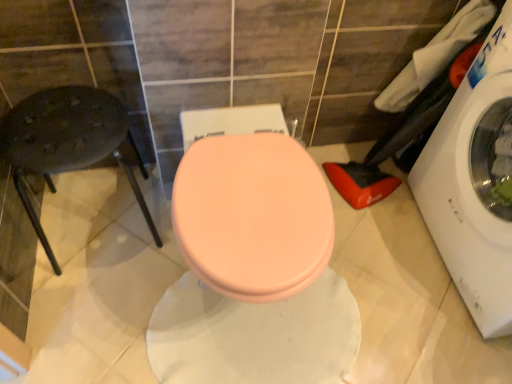
Describe the element at coordinates (67, 141) in the screenshot. The image size is (512, 384). I see `metallic black stool at left` at that location.

This screenshot has width=512, height=384. What do you see at coordinates (475, 183) in the screenshot? I see `white glossy washing machine at right` at bounding box center [475, 183].

Find the location of `metallic black stool at left`. metallic black stool at left is located at coordinates (67, 141).

Are metallic black stool at left and matte pink toilet seat at center far apart?

No.

Is metallic black stool at left aimed at matte pink toilet seat at center?

No, metallic black stool at left does not turn towards matte pink toilet seat at center.

Is metallic black stool at left completely or partially outside of matte pink toilet seat at center?

Indeed, metallic black stool at left is completely outside matte pink toilet seat at center.

From a real-world perspective, is white fabric at upper right, placed as the 1th laundry when sorted from left to right, under white glossy washing machine at right?

Incorrect, from a real-world perspective, white fabric at upper right, placed as the 1th laundry when sorted from left to right, is higher than white glossy washing machine at right.

Is white fabric at upper right, placed as the 1th laundry when sorted from left to right, turned away from white glossy washing machine at right?

white fabric at upper right, placed as the 1th laundry when sorted from left to right, is not turned away from white glossy washing machine at right.

This screenshot has width=512, height=384. There is a white glossy washing machine at right. What are the coordinates of `the 2nd laundry above it (from a real-world perspective)` in the screenshot? It's located at 435,56.

Is white fabric at upper right, placed as the 1th laundry when sorted from left to right, smaller than white glossy washing machine at right?

Correct, white fabric at upper right, placed as the 1th laundry when sorted from left to right, occupies less space than white glossy washing machine at right.

Which is correct: matte pink toilet seat at center is inside white glossy washing machine at right, or outside of it?

matte pink toilet seat at center is outside white glossy washing machine at right.

From the image's perspective, would you say matte pink toilet seat at center is shown under white glossy washing machine at right?

Correct, matte pink toilet seat at center appears lower than white glossy washing machine at right in the image.

This screenshot has height=384, width=512. What are the coordinates of `washing machine that is above the matte pink toilet seat at center (from the image's perspective)` in the screenshot? It's located at (475, 183).

Consider the image. How many degrees apart are the facing directions of matte pink toilet seat at center and white glossy washing machine at right?

The angle between the facing direction of matte pink toilet seat at center and the facing direction of white glossy washing machine at right is 89.4 degrees.

Is white fabric at upper right, acting as the second laundry starting from the right, aimed at white fabric laundry at right, arranged as the first laundry when viewed from the right?

Yes, white fabric at upper right, acting as the second laundry starting from the right, faces towards white fabric laundry at right, arranged as the first laundry when viewed from the right.

From a real-world perspective, does white fabric at upper right, acting as the second laundry starting from the right, sit lower than white fabric laundry at right, the 2th laundry from the left?

Incorrect, from a real-world perspective, white fabric at upper right, acting as the second laundry starting from the right, is higher than white fabric laundry at right, the 2th laundry from the left.

Is white fabric at upper right, acting as the second laundry starting from the right, bigger than white fabric laundry at right, the 2th laundry from the left?

No, white fabric at upper right, acting as the second laundry starting from the right, is not bigger than white fabric laundry at right, the 2th laundry from the left.

In terms of height, does white fabric at upper right, placed as the 1th laundry when sorted from left to right, look taller or shorter compared to white fabric laundry at right, arranged as the first laundry when viewed from the right?

white fabric at upper right, placed as the 1th laundry when sorted from left to right, is shorter than white fabric laundry at right, arranged as the first laundry when viewed from the right.

Looking at this image, which object is closer to the camera taking this photo, white fabric laundry at right, arranged as the first laundry when viewed from the right, or white fabric at upper right, acting as the second laundry starting from the right?

white fabric laundry at right, arranged as the first laundry when viewed from the right, is in front.

Is point (381, 190) more distant than point (432, 64)?

Yes, it is.

Does white fabric laundry at right, arranged as the first laundry when viewed from the right, turn towards white fabric at upper right, acting as the second laundry starting from the right?

No, white fabric laundry at right, arranged as the first laundry when viewed from the right, is not aimed at white fabric at upper right, acting as the second laundry starting from the right.

From the image's perspective, who appears lower, white fabric laundry at right, the 2th laundry from the left, or white fabric at upper right, acting as the second laundry starting from the right?

white fabric laundry at right, the 2th laundry from the left, appears lower in the image.

How different are the orientations of white fabric laundry at right, arranged as the first laundry when viewed from the right, and white glossy washing machine at right in degrees?

8.34 degrees separate the facing orientations of white fabric laundry at right, arranged as the first laundry when viewed from the right, and white glossy washing machine at right.

From the image's perspective, between white fabric laundry at right, arranged as the first laundry when viewed from the right, and white glossy washing machine at right, who is located below?

white glossy washing machine at right is shown below in the image.

Is white fabric laundry at right, the 2th laundry from the left, at the right side of white glossy washing machine at right?

No, white fabric laundry at right, the 2th laundry from the left, is not to the right of white glossy washing machine at right.

Is white fabric laundry at right, the 2th laundry from the left, not inside white glossy washing machine at right?

white fabric laundry at right, the 2th laundry from the left, is positioned outside white glossy washing machine at right.

From a real-world perspective, is matte pink toilet seat at center under white fabric laundry at right, arranged as the first laundry when viewed from the right?

Yes, from a real-world perspective, matte pink toilet seat at center is beneath white fabric laundry at right, arranged as the first laundry when viewed from the right.

Are matte pink toilet seat at center and white fabric laundry at right, arranged as the first laundry when viewed from the right, making contact?

No, matte pink toilet seat at center is not next to white fabric laundry at right, arranged as the first laundry when viewed from the right.

From the image's perspective, who appears lower, matte pink toilet seat at center or white fabric laundry at right, arranged as the first laundry when viewed from the right?

matte pink toilet seat at center, from the image's perspective.

Does point (223, 157) lie behind point (365, 191)?

That is False.

I want to click on bar stool located above the matte pink toilet seat at center (from the image's perspective), so click(x=67, y=141).

The width and height of the screenshot is (512, 384). I want to click on washing machine that appears below the white fabric at upper right, acting as the second laundry starting from the right (from the image's perspective), so point(475,183).

When comparing their distances from white fabric laundry at right, arranged as the first laundry when viewed from the right, does white glossy washing machine at right or matte pink toilet seat at center seem further?

matte pink toilet seat at center is further to white fabric laundry at right, arranged as the first laundry when viewed from the right.

When comparing their distances from matte pink toilet seat at center, does white fabric laundry at right, arranged as the first laundry when viewed from the right, or metallic black stool at left seem closer?

Based on the image, metallic black stool at left appears to be nearer to matte pink toilet seat at center.

Which object lies nearer to the anchor point white fabric laundry at right, arranged as the first laundry when viewed from the right, white fabric at upper right, acting as the second laundry starting from the right, or metallic black stool at left?

Based on the image, white fabric at upper right, acting as the second laundry starting from the right, appears to be nearer to white fabric laundry at right, arranged as the first laundry when viewed from the right.

Based on their spatial positions, is white fabric at upper right, acting as the second laundry starting from the right, or white glossy washing machine at right further from white fabric laundry at right, the 2th laundry from the left?

white glossy washing machine at right.

Considering their positions, is matte pink toilet seat at center positioned further to white fabric at upper right, placed as the 1th laundry when sorted from left to right, than white fabric laundry at right, arranged as the first laundry when viewed from the right?

Among the two, matte pink toilet seat at center is located further to white fabric at upper right, placed as the 1th laundry when sorted from left to right.

Considering their positions, is metallic black stool at left positioned further to white fabric at upper right, placed as the 1th laundry when sorted from left to right, than white fabric laundry at right, the 2th laundry from the left?

metallic black stool at left is further to white fabric at upper right, placed as the 1th laundry when sorted from left to right.

When comparing their distances from matte pink toilet seat at center, does white glossy washing machine at right or white fabric laundry at right, the 2th laundry from the left, seem closer?

Among the two, white glossy washing machine at right is located nearer to matte pink toilet seat at center.

Which object lies further to the anchor point white glossy washing machine at right, white fabric at upper right, acting as the second laundry starting from the right, or matte pink toilet seat at center?

The object further to white glossy washing machine at right is matte pink toilet seat at center.

This screenshot has height=384, width=512. Find the location of `toilet between metallic black stool at left and white glossy washing machine at right from left to right`. toilet between metallic black stool at left and white glossy washing machine at right from left to right is located at coordinates (252, 215).

Find the location of `laundry between metallic black stool at left and white fabric laundry at right, the 2th laundry from the left`. laundry between metallic black stool at left and white fabric laundry at right, the 2th laundry from the left is located at coordinates (435, 56).

Find the location of a particular element. The image size is (512, 384). toilet between metallic black stool at left and white fabric at upper right, placed as the 1th laundry when sorted from left to right is located at coordinates (252, 215).

At what (x,y) coordinates should I click in order to perform the action: click on laundry between white glossy washing machine at right and white fabric at upper right, placed as the 1th laundry when sorted from left to right, from front to back. Please return your answer as a coordinate pair (x, y). Looking at the image, I should click on point(401,133).